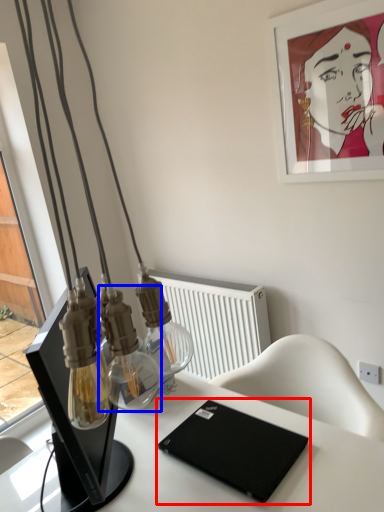
Question: Which of the following is the closest to the observer, laptop (highlighted by a red box) or bottle (highlighted by a blue box)?

Choices:
 (A) laptop
 (B) bottle

Answer: (A)